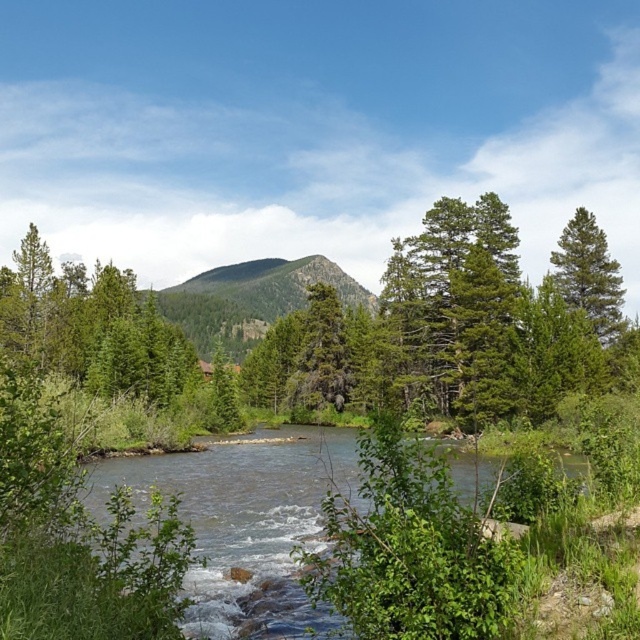
Does green textured mountain at center have a lesser width compared to green matte tree at right?

Incorrect, green textured mountain at center's width is not less than green matte tree at right's.

Is green textured mountain at center to the right of green matte tree at right from the viewer's perspective?

In fact, green textured mountain at center is to the left of green matte tree at right.

I want to click on green textured mountain at center, so click(x=250, y=300).

Find the location of a particular element. Image resolution: width=640 pixels, height=640 pixels. green textured mountain at center is located at coordinates (250, 300).

Is clear water at center to the right of green matte tree at right from the viewer's perspective?

Incorrect, clear water at center is not on the right side of green matte tree at right.

Does point (310, 522) come in front of point (602, 280)?

Yes, point (310, 522) is closer to viewer.

Does point (260, 596) come closer to viewer compared to point (586, 301)?

Yes, point (260, 596) is closer to viewer.

Where is `clear water at center`? Image resolution: width=640 pixels, height=640 pixels. clear water at center is located at coordinates (244, 524).

Does clear water at center have a lesser width compared to green textured mountain at center?

Yes, clear water at center is thinner than green textured mountain at center.

Between point (266, 445) and point (204, 346), which one is positioned behind?

Positioned behind is point (204, 346).

Which is behind, point (292, 632) or point (170, 304)?

Positioned behind is point (170, 304).

In order to click on clear water at center in this screenshot , I will do coord(244,524).